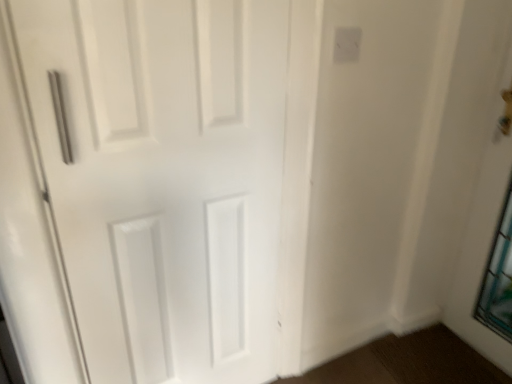
Question: Can you confirm if white plastic electric outlet at upper right is smaller than white matte door at left?

Choices:
 (A) no
 (B) yes

Answer: (B)

Question: Considering the relative sizes of white plastic electric outlet at upper right and white matte door at left in the image provided, is white plastic electric outlet at upper right bigger than white matte door at left?

Choices:
 (A) yes
 (B) no

Answer: (B)

Question: From a real-world perspective, is white plastic electric outlet at upper right physically below white matte door at left?

Choices:
 (A) no
 (B) yes

Answer: (A)

Question: From the image's perspective, is white plastic electric outlet at upper right on top of white matte door at left?

Choices:
 (A) no
 (B) yes

Answer: (B)

Question: Is white plastic electric outlet at upper right to the right of white matte door at left from the viewer's perspective?

Choices:
 (A) no
 (B) yes

Answer: (B)

Question: Is white plastic electric outlet at upper right taller than white matte door at left?

Choices:
 (A) no
 (B) yes

Answer: (A)

Question: Is white matte door at left not near white plastic electric outlet at upper right?

Choices:
 (A) no
 (B) yes

Answer: (A)

Question: Are white matte door at left and white plastic electric outlet at upper right beside each other?

Choices:
 (A) no
 (B) yes

Answer: (A)

Question: Is white matte door at left outside white plastic electric outlet at upper right?

Choices:
 (A) no
 (B) yes

Answer: (B)

Question: Is white plastic electric outlet at upper right a part of white matte door at left?

Choices:
 (A) no
 (B) yes

Answer: (A)

Question: From a real-world perspective, is white matte door at left over white plastic electric outlet at upper right?

Choices:
 (A) yes
 (B) no

Answer: (B)

Question: Does white matte door at left have a lesser width compared to white plastic electric outlet at upper right?

Choices:
 (A) yes
 (B) no

Answer: (B)

Question: Is white matte door at left taller or shorter than white plastic electric outlet at upper right?

Choices:
 (A) short
 (B) tall

Answer: (B)